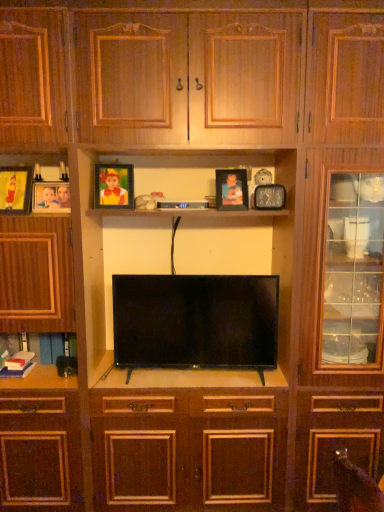
Question: From the image's perspective, is matte black clock at upper center, which is counted as the first picture frame, starting from the right, under matte wooden picture frame at left, arranged as the 1th picture frame when viewed from the left?

Choices:
 (A) yes
 (B) no

Answer: (A)

Question: Is matte black clock at upper center, which is counted as the first picture frame, starting from the right, bigger than matte wooden picture frame at left, which is the fifth picture frame in right-to-left order?

Choices:
 (A) no
 (B) yes

Answer: (A)

Question: Does matte black clock at upper center, which is counted as the first picture frame, starting from the right, have a greater width compared to matte wooden picture frame at left, which is the fifth picture frame in right-to-left order?

Choices:
 (A) yes
 (B) no

Answer: (B)

Question: From a real-world perspective, is matte black clock at upper center, which is counted as the first picture frame, starting from the right, physically below matte wooden picture frame at left, which is the fifth picture frame in right-to-left order?

Choices:
 (A) no
 (B) yes

Answer: (B)

Question: Does matte black clock at upper center, which is counted as the first picture frame, starting from the right, turn towards matte wooden picture frame at left, which is the fifth picture frame in right-to-left order?

Choices:
 (A) no
 (B) yes

Answer: (A)

Question: Is matte black clock at upper center, which is counted as the first picture frame, starting from the right, further to camera compared to matte wooden picture frame at left, arranged as the 1th picture frame when viewed from the left?

Choices:
 (A) yes
 (B) no

Answer: (A)

Question: Does matte gold picture frame at upper left, which ranks as the 3th picture frame in right-to-left order, have a greater height compared to black plastic remote control at center?

Choices:
 (A) yes
 (B) no

Answer: (A)

Question: Is matte gold picture frame at upper left, which ranks as the 3th picture frame in right-to-left order, looking in the opposite direction of black plastic remote control at center?

Choices:
 (A) no
 (B) yes

Answer: (A)

Question: Is black plastic remote control at center completely or partially inside matte gold picture frame at upper left, which is counted as the third picture frame, starting from the left?

Choices:
 (A) yes
 (B) no

Answer: (B)

Question: Considering the relative positions of matte gold picture frame at upper left, which ranks as the 3th picture frame in right-to-left order, and black plastic remote control at center in the image provided, is matte gold picture frame at upper left, which ranks as the 3th picture frame in right-to-left order, in front of black plastic remote control at center?

Choices:
 (A) no
 (B) yes

Answer: (B)

Question: From a real-world perspective, is matte gold picture frame at upper left, which is counted as the third picture frame, starting from the left, located higher than black plastic remote control at center?

Choices:
 (A) yes
 (B) no

Answer: (A)

Question: From the image's perspective, does matte gold picture frame at upper left, which is counted as the third picture frame, starting from the left, appear lower than black plastic remote control at center?

Choices:
 (A) no
 (B) yes

Answer: (A)

Question: Can you see matte gold picture frame at upper left, which is counted as the third picture frame, starting from the left, touching matte wooden picture frame at left, which is the fifth picture frame in right-to-left order?

Choices:
 (A) yes
 (B) no

Answer: (B)